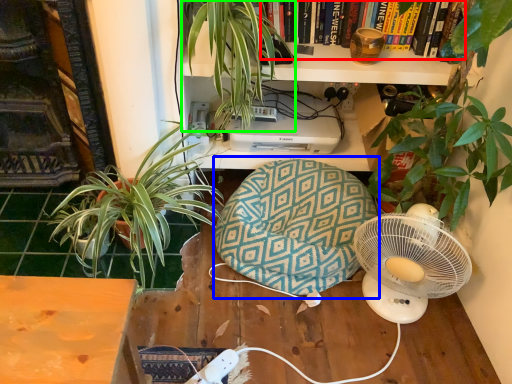
Question: Based on their relative distances, which object is farther from book (highlighted by a red box)? Choose from bean bag chair (highlighted by a blue box) and houseplant (highlighted by a green box).

Choices:
 (A) bean bag chair
 (B) houseplant

Answer: (A)